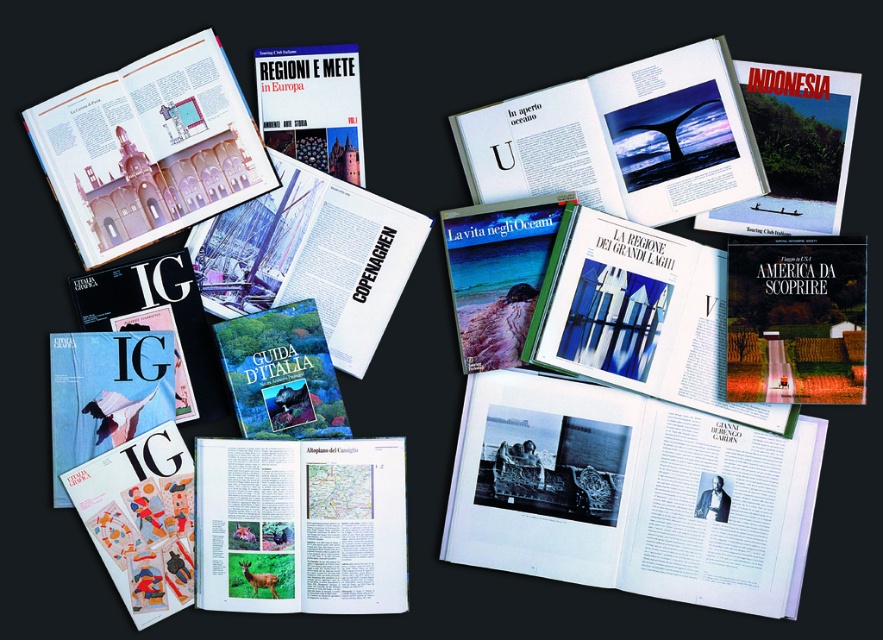
Is matte pink building at upper left below matte paper guide at center?

No.

Find the location of a particular element. This screenshot has width=883, height=640. matte pink building at upper left is located at coordinates (149, 148).

Identify the location of matte pink building at upper left. (149, 148).

Based on the photo, does matte blue whale tail at upper center have a greater height compared to matte pink building at upper left?

No, matte blue whale tail at upper center is not taller than matte pink building at upper left.

Is matte blue whale tail at upper center bigger than matte pink building at upper left?

Yes.

Identify the location of matte blue whale tail at upper center. (623, 140).

Between black glossy book at center and matte blue whale tail at upper center, which one has less height?

matte blue whale tail at upper center

Who is more forward, [563,516] or [580,140]?

Positioned in front is point [563,516].

Locate an element on the screen. black glossy book at center is located at coordinates (627, 493).